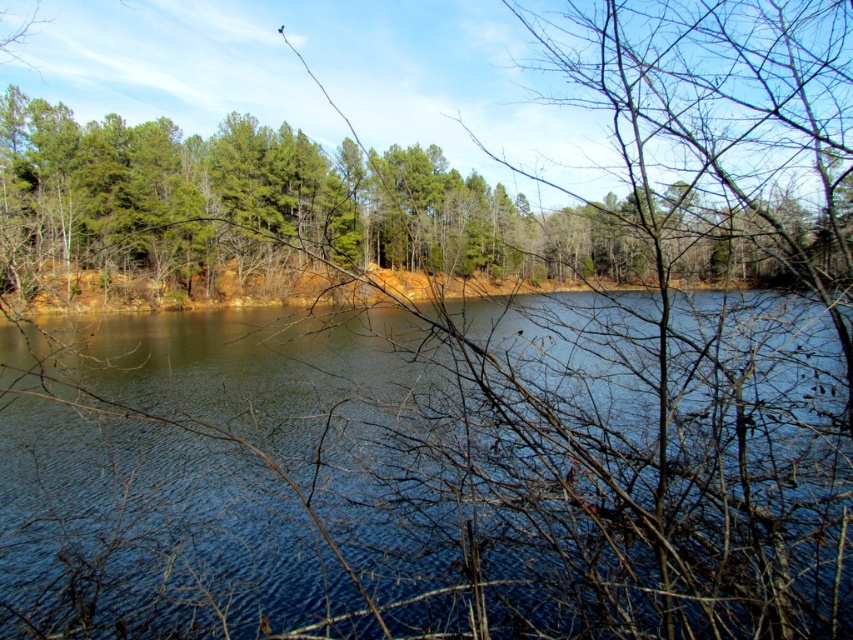
Is blue water at center smaller than green matte trees at center?

Yes.

What do you see at coordinates (428, 474) in the screenshot? I see `blue water at center` at bounding box center [428, 474].

Between point (312, 317) and point (178, 252), which one is positioned in front?

Point (178, 252)

This screenshot has height=640, width=853. I want to click on blue water at center, so click(428, 474).